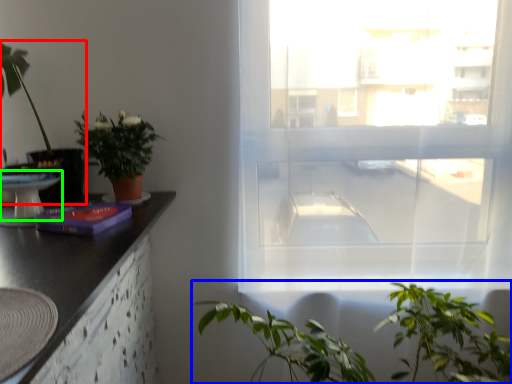
Question: Estimate the real-world distances between objects in this image. Which object is farther from houseplant (highlighted by a red box), vegetation (highlighted by a blue box) or round table (highlighted by a green box)?

Choices:
 (A) vegetation
 (B) round table

Answer: (A)